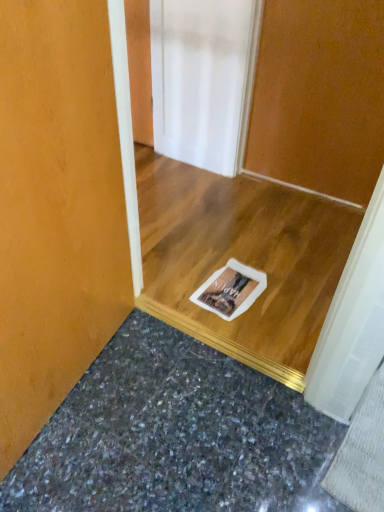
Question: Considering the relative sizes of granite at lower center and wooden door at center in the image provided, is granite at lower center smaller than wooden door at center?

Choices:
 (A) no
 (B) yes

Answer: (B)

Question: Is granite at lower center beside wooden door at center?

Choices:
 (A) yes
 (B) no

Answer: (B)

Question: Considering the relative sizes of granite at lower center and wooden door at center in the image provided, is granite at lower center bigger than wooden door at center?

Choices:
 (A) yes
 (B) no

Answer: (B)

Question: Is granite at lower center positioned behind wooden door at center?

Choices:
 (A) no
 (B) yes

Answer: (A)

Question: Does granite at lower center have a greater width compared to wooden door at center?

Choices:
 (A) yes
 (B) no

Answer: (A)

Question: Considering the relative sizes of granite at lower center and wooden door at center in the image provided, is granite at lower center taller than wooden door at center?

Choices:
 (A) no
 (B) yes

Answer: (A)

Question: Is wooden door at center surrounding granite at lower center?

Choices:
 (A) yes
 (B) no

Answer: (B)

Question: From the image's perspective, is wooden door at center under granite at lower center?

Choices:
 (A) no
 (B) yes

Answer: (A)

Question: Is there a large distance between wooden door at center and granite at lower center?

Choices:
 (A) yes
 (B) no

Answer: (A)

Question: Does wooden door at center have a lesser width compared to granite at lower center?

Choices:
 (A) yes
 (B) no

Answer: (A)

Question: Is wooden door at center placed right next to granite at lower center?

Choices:
 (A) no
 (B) yes

Answer: (A)

Question: From a real-world perspective, does wooden door at center stand above granite at lower center?

Choices:
 (A) no
 (B) yes

Answer: (B)

Question: From the image's perspective, is granite at lower center positioned above or below wooden door at center?

Choices:
 (A) above
 (B) below

Answer: (B)